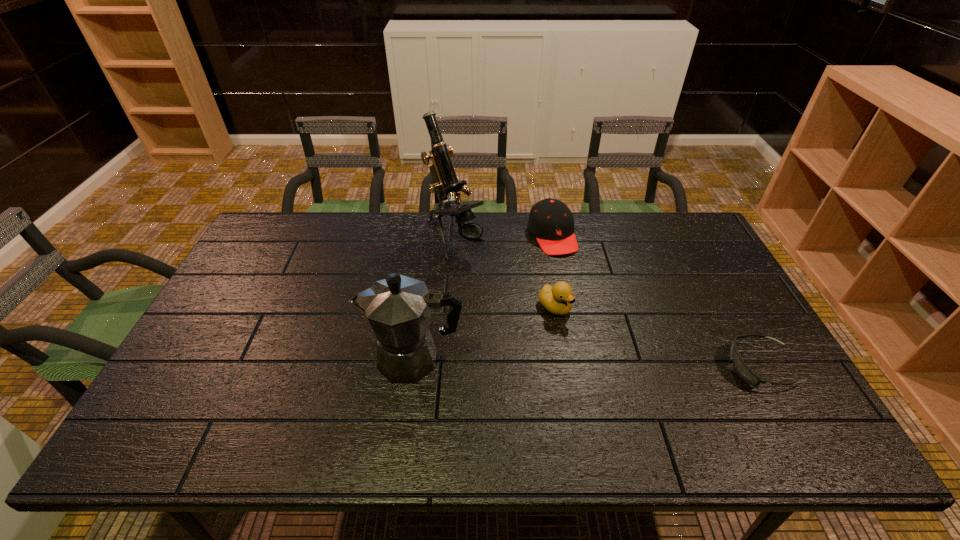
The width and height of the screenshot is (960, 540). Identify the location of free spot between the tallest object and the third nearest object. (504, 273).

Locate which object ranks fourth in proximity to the microscope. Please provide its 2D coordinates. Your answer should be formatted as a tuple, i.e. [(x, y)], where the tuple contains the x and y coordinates of a point satisfying the conditions above.

[(741, 368)]

Choose which object is the fourth nearest neighbor to the coffeepot. Please provide its 2D coordinates. Your answer should be formatted as a tuple, i.e. [(x, y)], where the tuple contains the x and y coordinates of a point satisfying the conditions above.

[(741, 368)]

Identify the location of free point that satisfies the following two spatial constraints: 1. on the front side of the microscope; 2. on the lenses of the goggles. (445, 367).

Where is `vacant space that satisfies the following two spatial constraints: 1. on the back side of the third nearest object; 2. on the right side of the cap`? vacant space that satisfies the following two spatial constraints: 1. on the back side of the third nearest object; 2. on the right side of the cap is located at coordinates (542, 235).